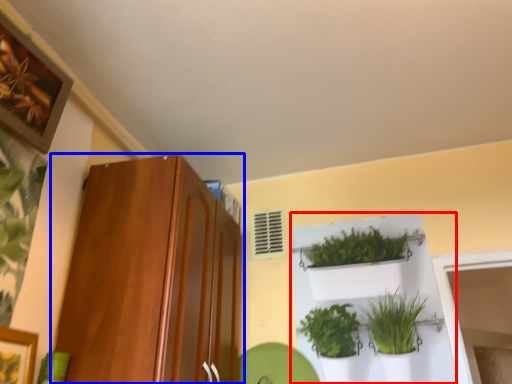
Question: Among these objects, which one is farthest to the camera, shelf (highlighted by a red box) or cabinetry (highlighted by a blue box)?

Choices:
 (A) shelf
 (B) cabinetry

Answer: (A)